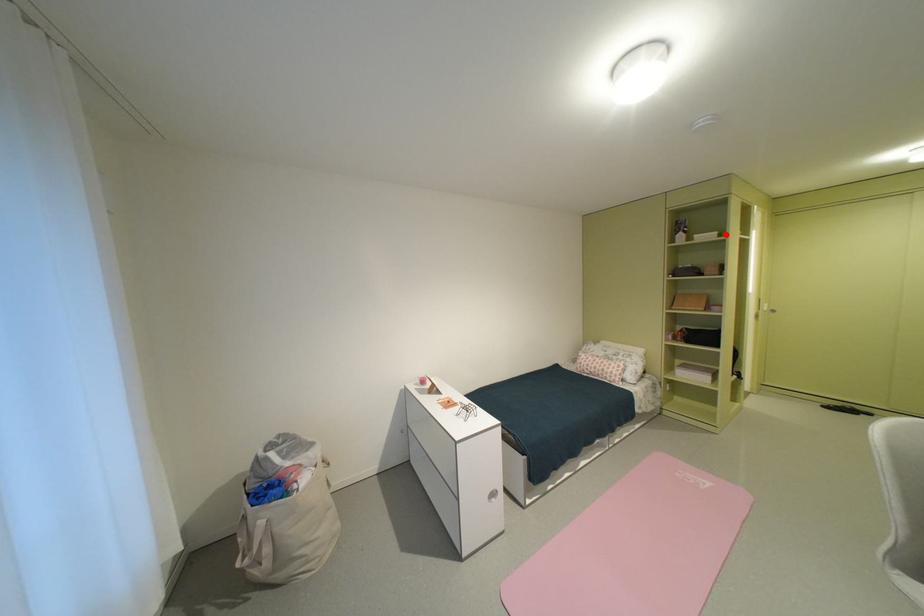
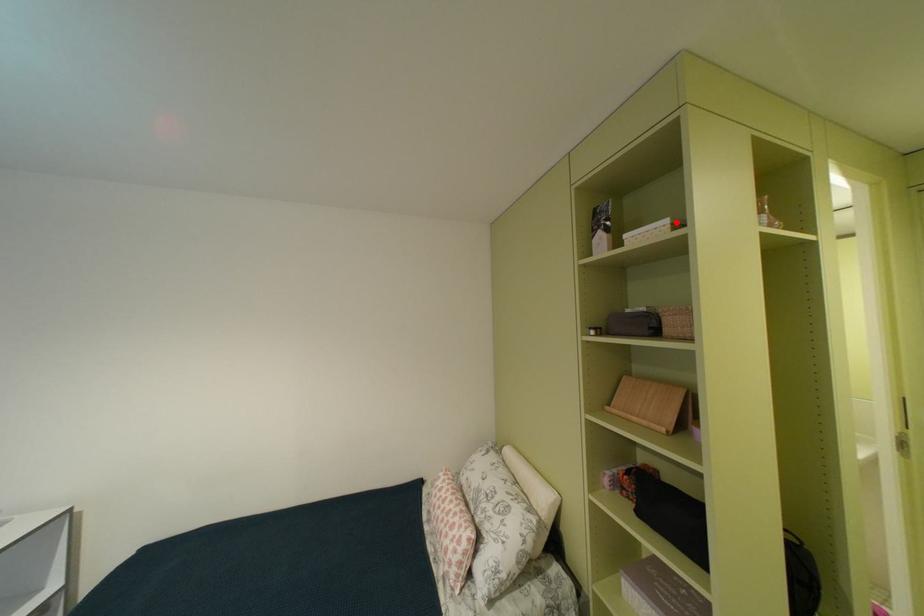
I am providing you with two images of the same scene from different viewpoints. A red point is marked on the first image and another point is marked on the second image. Is the red point in image1 aligned with the point shown in image2?

Yes